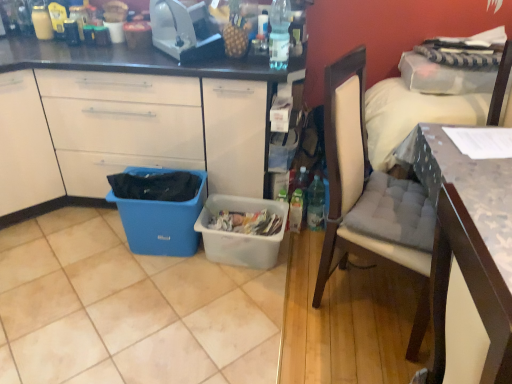
Where is `free point to the left of white plastic toaster at upper center`? This screenshot has height=384, width=512. free point to the left of white plastic toaster at upper center is located at coordinates (133, 57).